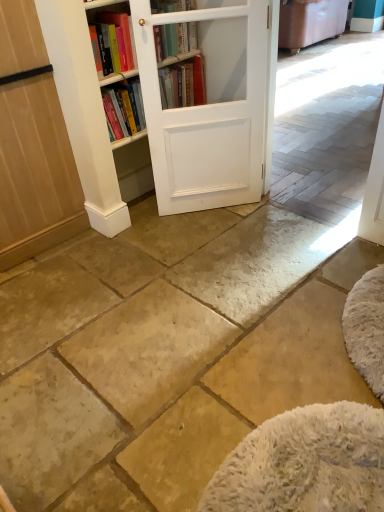
Question: From a real-world perspective, is hardcover book at upper center physically located above or below white wood bookcase at center?

Choices:
 (A) below
 (B) above

Answer: (B)

Question: Relative to white wood bookcase at center, is hardcover book at upper center in front or behind?

Choices:
 (A) front
 (B) behind

Answer: (A)

Question: Which is nearer to the natural stone floor at center?

Choices:
 (A) white matte barn door at center
 (B) light brown wood screen door at left
 (C) hardcover book at upper center
 (D) white wood bookcase at center

Answer: (B)

Question: Which of these objects is positioned farthest from the light brown wood screen door at left?

Choices:
 (A) natural stone floor at center
 (B) hardcover book at upper center
 (C) white wood bookcase at center
 (D) white matte barn door at center

Answer: (B)